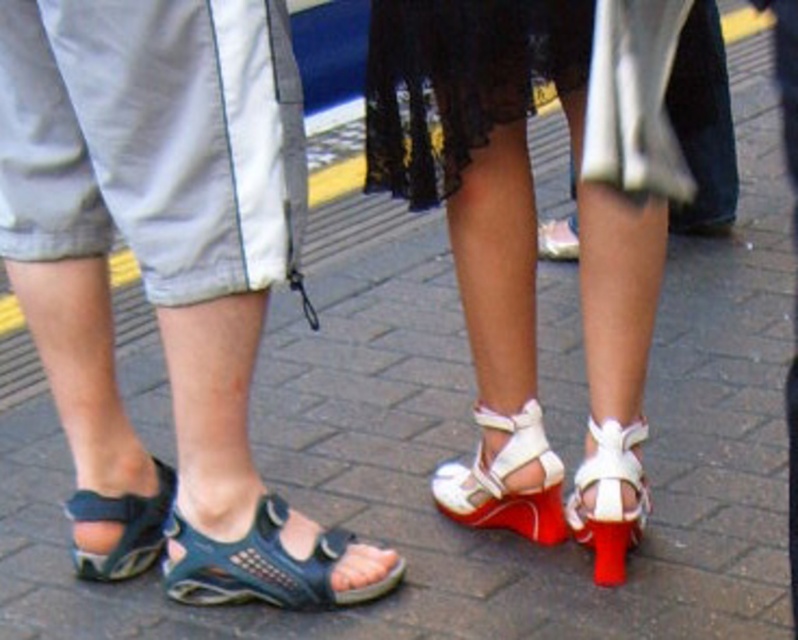
Looking at this image, you are a fashion designer observing the image. You need to determine which item is more suitable for a formal event. Based on their sizes, which item from the black lace dress at center and the white matte sandal at center would you recommend?

The black lace dress at center is bigger than the white matte sandal at center, so it is more suitable for a formal event as larger garments often have a more elegant appearance.

You are a fashion designer analyzing footwear in an image. You observe the matte blue sandals at lower left and the white leather sandal at center. Which sandal has a higher height?

The matte blue sandals at lower left has a greater height compared to the white leather sandal at center.

You are standing at the point marked by the coordinates point (460, 80) in the image. What object is located exactly at that point?

The point (460, 80) is occupied by the black lace dress at center.